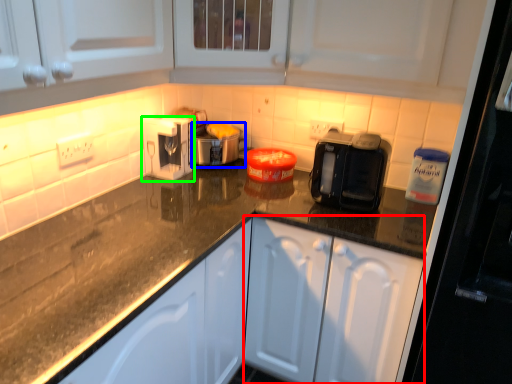
Question: Based on their relative distances, which object is nearer to cabinetry (highlighted by a red box)? Choose from appliance (highlighted by a blue box) and kitchen appliance (highlighted by a green box).

Choices:
 (A) appliance
 (B) kitchen appliance

Answer: (A)